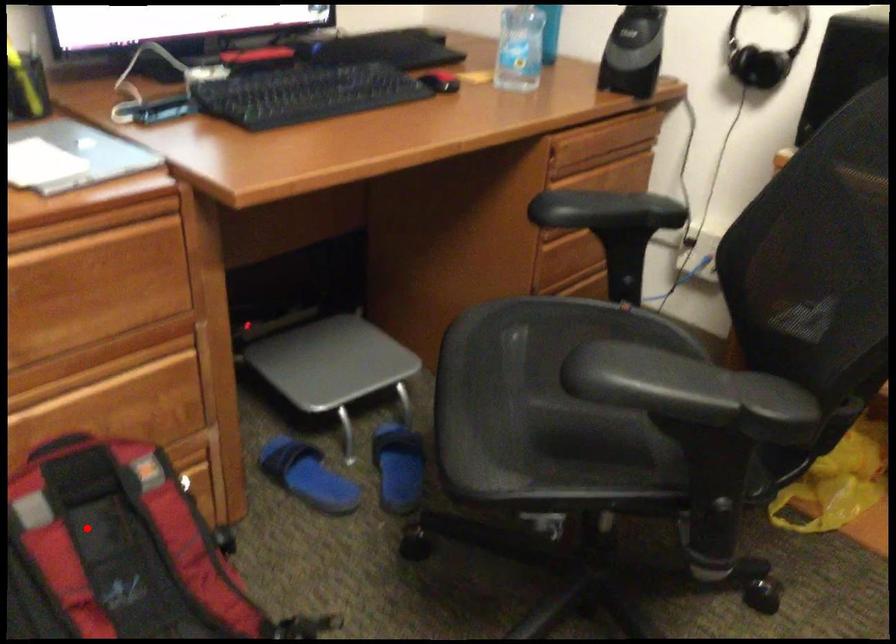
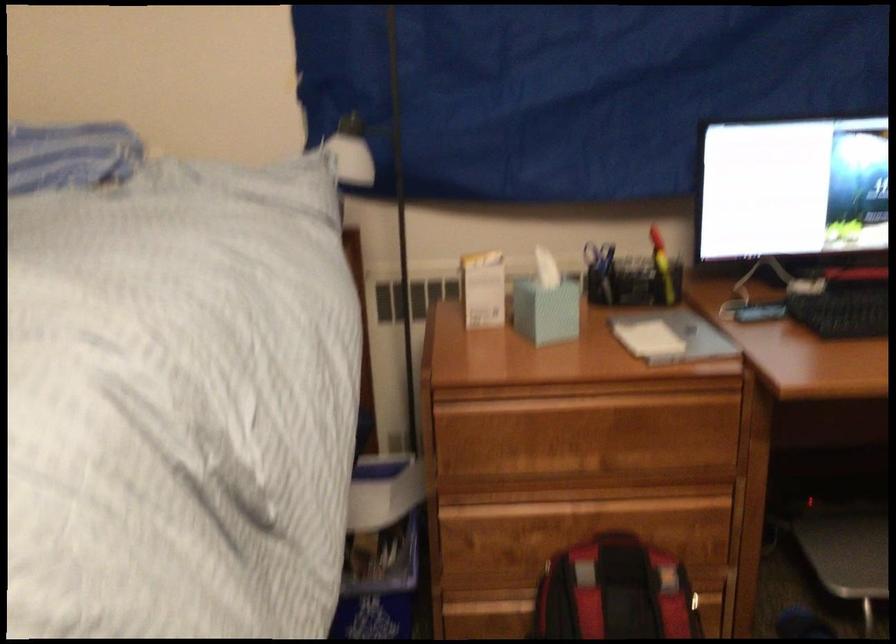
Find the pixel in the second image that matches the highlighted location in the first image.

(615, 592)